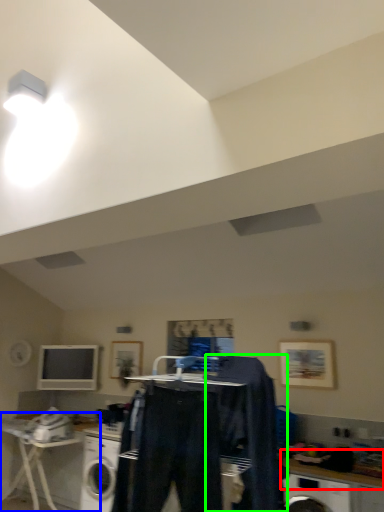
Question: Considering the real-world distances, which object is farthest from counter top (highlighted by a red box)? table (highlighted by a blue box) or clothing (highlighted by a green box)?

Choices:
 (A) table
 (B) clothing

Answer: (A)